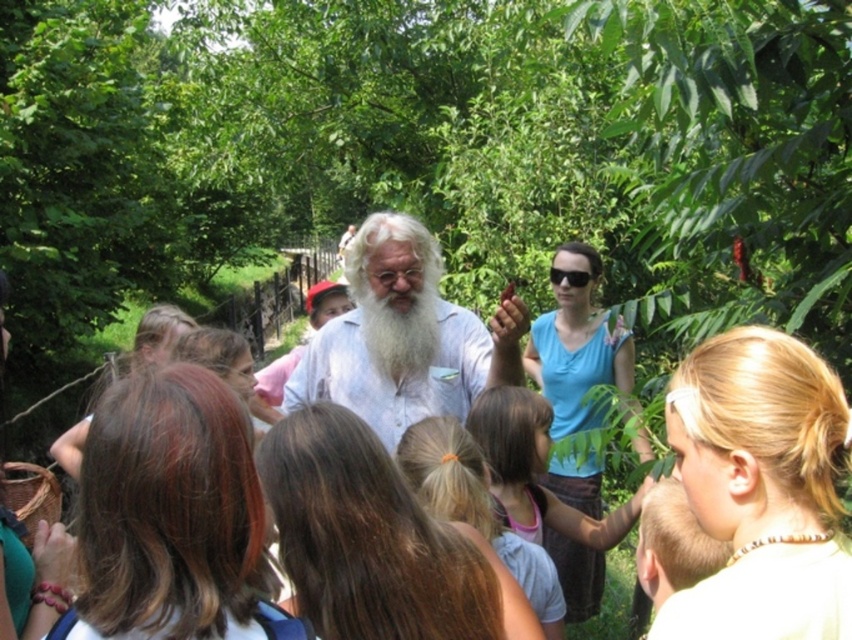
Between point (538, 404) and point (468, 506), which one is positioned in front?

Point (468, 506)

Is point (498, 493) positioned behind point (427, 484)?

Yes, point (498, 493) is farther from viewer.

Where is `brown fabric skirt at center`? The image size is (852, 640). brown fabric skirt at center is located at coordinates (536, 472).

The width and height of the screenshot is (852, 640). In order to click on brown fabric skirt at center in this screenshot , I will do `click(536, 472)`.

Between point (563, 509) and point (392, 358), which one is positioned in front?

Positioned in front is point (563, 509).

Between point (499, 496) and point (413, 368), which one is positioned behind?

The point (413, 368) is more distant.

Identify the location of brown fabric skirt at center. (536, 472).

Who is positioned more to the right, white matte beard at center or black plastic sunglasses at center?

white matte beard at center

Measure the distance from white matte beard at center to black plastic sunglasses at center.

The distance of white matte beard at center from black plastic sunglasses at center is 11.93 inches.

Is point (628, 349) behind point (551, 284)?

That is False.

This screenshot has width=852, height=640. Find the location of `white matte beard at center`. white matte beard at center is located at coordinates (577, 346).